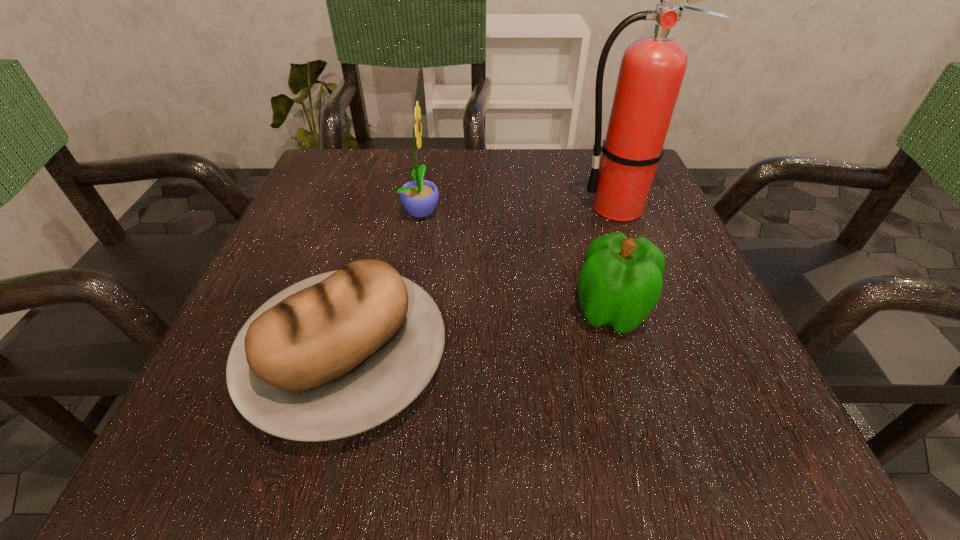
The height and width of the screenshot is (540, 960). In the image, there is a desktop. In order to click on free space at the left edge in this screenshot , I will do `click(332, 225)`.

In the image, there is a desktop. At what (x,y) coordinates should I click in order to perform the action: click on vacant area at the right edge. Please return your answer as a coordinate pair (x, y). Looking at the image, I should click on (647, 352).

Where is `free location at the far left corner`? This screenshot has height=540, width=960. free location at the far left corner is located at coordinates (357, 172).

Locate an element on the screen. free spot at the near left corner of the desktop is located at coordinates [x=190, y=449].

Find the location of a particular element. The width and height of the screenshot is (960, 540). vacant space at the far right corner of the desktop is located at coordinates (587, 170).

In the image, there is a desktop. Where is `vacant area at the near right corner`? Image resolution: width=960 pixels, height=540 pixels. vacant area at the near right corner is located at coordinates (683, 476).

What are the coordinates of `free spot between the sunflower and the tallest object` in the screenshot? It's located at (520, 209).

The width and height of the screenshot is (960, 540). What are the coordinates of `empty space that is in between the fire extinguisher and the second tallest object` in the screenshot? It's located at (520, 209).

Where is `vacant point located between the bell pepper and the sunflower`? The width and height of the screenshot is (960, 540). vacant point located between the bell pepper and the sunflower is located at coordinates (516, 261).

Locate an element on the screen. empty space between the tallest object and the bread is located at coordinates (482, 282).